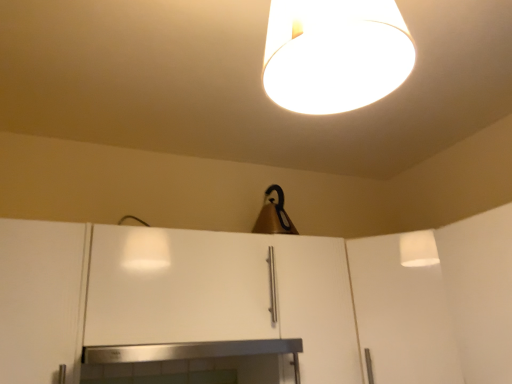
Question: Is white matte cabinet at center, which is counted as the 2th cabinetry, starting from the left, further to the viewer compared to white matte lampshade at upper center, the second lamp in the back-to-front sequence?

Choices:
 (A) yes
 (B) no

Answer: (A)

Question: Is white matte cabinet at center, which is counted as the 2th cabinetry, starting from the left, positioned in front of white matte lampshade at upper center, the second lamp in the back-to-front sequence?

Choices:
 (A) yes
 (B) no

Answer: (B)

Question: From a real-world perspective, is white matte cabinet at center, which is counted as the 2th cabinetry, starting from the left, over white matte lampshade at upper center, which is the first lamp in front-to-back order?

Choices:
 (A) yes
 (B) no

Answer: (B)

Question: Is white matte cabinet at center, which is counted as the 2th cabinetry, starting from the left, aimed at white matte lampshade at upper center, which ranks as the 1th lamp in top-to-bottom order?

Choices:
 (A) yes
 (B) no

Answer: (A)

Question: Considering the relative sizes of white matte cabinet at center, placed as the 1th cabinetry when sorted from right to left, and white matte lampshade at upper center, marked as the second lamp in a bottom-to-top arrangement, in the image provided, is white matte cabinet at center, placed as the 1th cabinetry when sorted from right to left, taller than white matte lampshade at upper center, marked as the second lamp in a bottom-to-top arrangement,?

Choices:
 (A) no
 (B) yes

Answer: (A)

Question: Considering the positions of stainless steel fireplace at center and white matte lampshade at upper center, which ranks as the 1th lamp in top-to-bottom order, in the image, is stainless steel fireplace at center wider or thinner than white matte lampshade at upper center, which ranks as the 1th lamp in top-to-bottom order,?

Choices:
 (A) wide
 (B) thin

Answer: (A)

Question: Would you say stainless steel fireplace at center is to the left or to the right of white matte lampshade at upper center, which is the first lamp in front-to-back order, in the picture?

Choices:
 (A) left
 (B) right

Answer: (A)

Question: From the image's perspective, is stainless steel fireplace at center located above or below white matte lampshade at upper center, the second lamp in the back-to-front sequence?

Choices:
 (A) below
 (B) above

Answer: (A)

Question: Considering the positions of stainless steel fireplace at center and white matte lampshade at upper center, marked as the second lamp in a bottom-to-top arrangement, in the image, is stainless steel fireplace at center taller or shorter than white matte lampshade at upper center, marked as the second lamp in a bottom-to-top arrangement,?

Choices:
 (A) tall
 (B) short

Answer: (B)

Question: In terms of width, does white matte cabinet at left, which is the 1th cabinetry in left-to-right order, look wider or thinner when compared to white matte lampshade at upper center, which ranks as the 1th lamp in top-to-bottom order?

Choices:
 (A) thin
 (B) wide

Answer: (B)

Question: In the image, is white matte cabinet at left, which is the 1th cabinetry in left-to-right order, positioned in front of or behind white matte lampshade at upper center, which ranks as the 1th lamp in top-to-bottom order?

Choices:
 (A) behind
 (B) front

Answer: (A)

Question: Based on their positions, is white matte cabinet at left, which is the 1th cabinetry in left-to-right order, located to the left or right of white matte lampshade at upper center, which is the first lamp in front-to-back order?

Choices:
 (A) left
 (B) right

Answer: (A)

Question: Based on their sizes in the image, would you say white matte cabinet at left, which is counted as the second cabinetry, starting from the right, is bigger or smaller than white matte lampshade at upper center, which ranks as the 1th lamp in top-to-bottom order?

Choices:
 (A) big
 (B) small

Answer: (A)

Question: From a real-world perspective, is stainless steel fireplace at center above or below white matte cabinet at left, which is the 1th cabinetry in left-to-right order?

Choices:
 (A) above
 (B) below

Answer: (B)

Question: Considering the positions of stainless steel fireplace at center and white matte cabinet at left, which is counted as the second cabinetry, starting from the right, in the image, is stainless steel fireplace at center wider or thinner than white matte cabinet at left, which is counted as the second cabinetry, starting from the right,?

Choices:
 (A) wide
 (B) thin

Answer: (A)